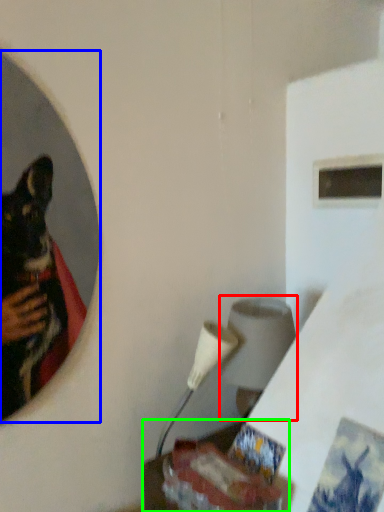
Question: Considering the real-world distances, which object is closest to lamp (highlighted by a red box)? mirror (highlighted by a blue box) or table (highlighted by a green box).

Choices:
 (A) mirror
 (B) table

Answer: (B)